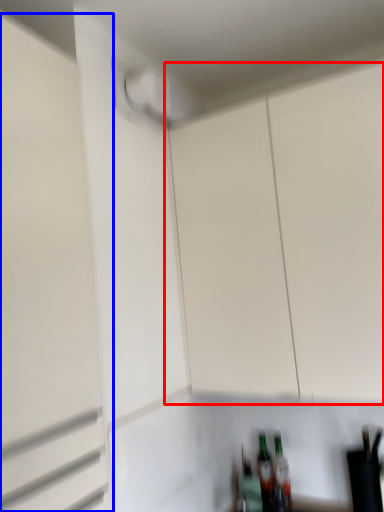
Question: Among these objects, which one is farthest to the camera, cabinetry (highlighted by a red box) or garage door (highlighted by a blue box)?

Choices:
 (A) cabinetry
 (B) garage door

Answer: (A)